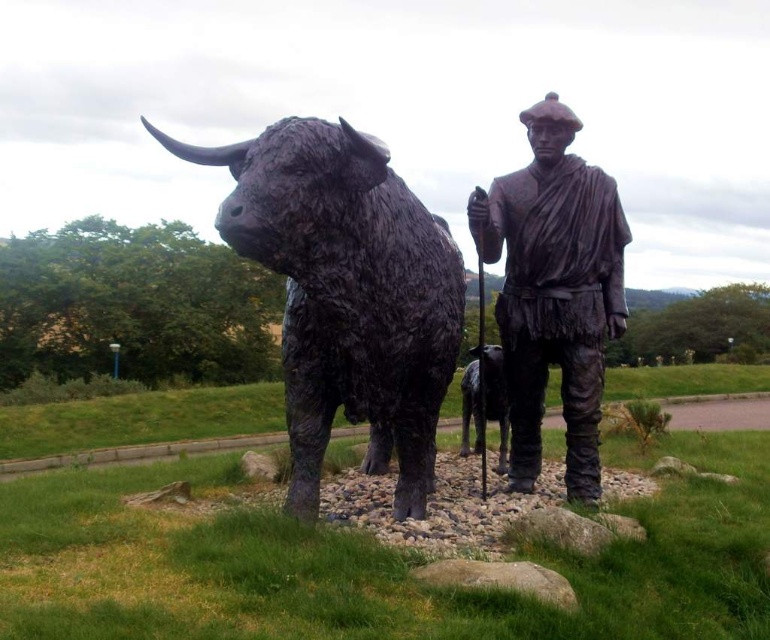
Question: Considering the relative positions of black textured bull at center and bronze statue at center in the image provided, where is black textured bull at center located with respect to bronze statue at center?

Choices:
 (A) left
 (B) right

Answer: (A)

Question: Observing the image, what is the correct spatial positioning of black textured bull at center in reference to bronze statue at center?

Choices:
 (A) right
 (B) left

Answer: (B)

Question: Which point is closer to the camera?

Choices:
 (A) (484, 385)
 (B) (581, 218)

Answer: (B)

Question: Is bronze statue at center below shiny black dog at center?

Choices:
 (A) no
 (B) yes

Answer: (A)

Question: Which object appears farthest from the camera in this image?

Choices:
 (A) shiny black dog at center
 (B) bronze statue at center

Answer: (A)

Question: Which point is closer to the camera taking this photo?

Choices:
 (A) (464, 422)
 (B) (342, 131)
 (C) (598, 356)

Answer: (B)